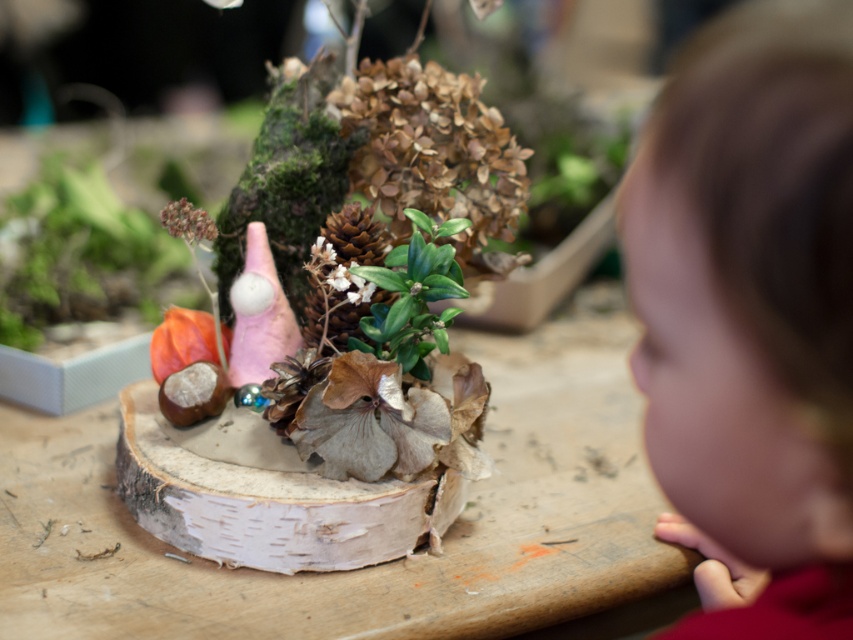
You are looking at a miniature garden on a wooden surface. There are two points marked in the scene. The first point is at coordinates point (78,230) and the second is at point (396,308). From your perspective, which point is closer to you?

Point (396,308) is closer to you because it is in front of point (78,230) according to their spatial arrangement.

You are a tiny explorer standing on the wooden surface where the miniature garden is placed. You want to sit down on the object that is bigger between the smooth brown hair at right and the green leafy plant at center. Which one should you choose?

The smooth brown hair at right has a larger size compared to the green leafy plant at center, so you should choose the smooth brown hair at right to sit on.

You are looking at the miniature garden scene on the wooden surface. There are two points marked in the image. The first point is at coordinates point (834, 355) and the second is at point (409, 209). Which point is closer to you?

Point (834, 355) is in front of point (409, 209), so the first point is closer to you.